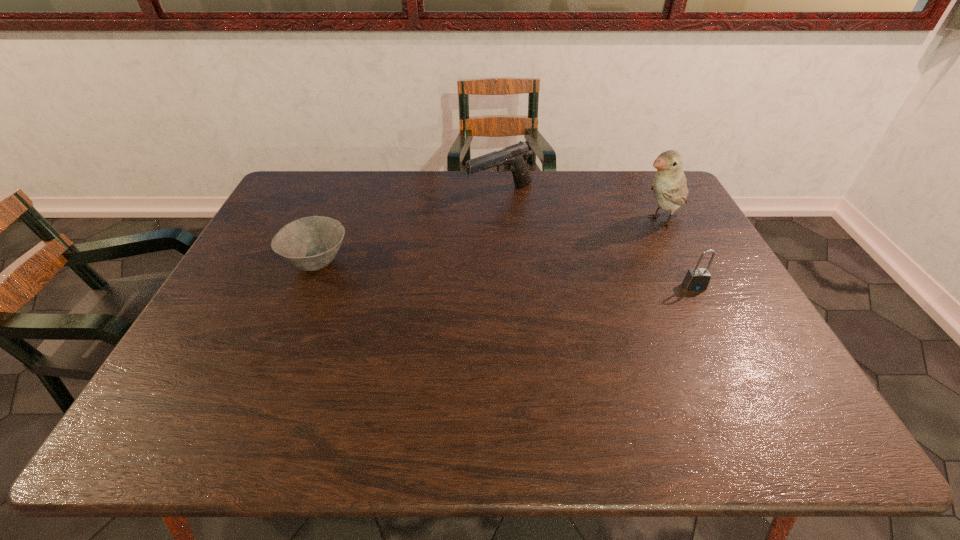
You are a GUI agent. You are given a task and a screenshot of the screen. Output one action in this format:
    pyautogui.click(x=<x>, y=<y>)
    Task: Click on the free point located at the face of the tallest object
    
    Given the screenshot: What is the action you would take?
    pyautogui.click(x=616, y=237)

You are a GUI agent. You are given a task and a screenshot of the screen. Output one action in this format:
    pyautogui.click(x=<x>, y=<y>)
    Task: Click on the free space located at the face of the tallest object
    
    Given the screenshot: What is the action you would take?
    tap(570, 258)

Image resolution: width=960 pixels, height=540 pixels. I want to click on vacant space positioned at the muzzle of the gun, so click(x=470, y=242).

Where is `vacant area situated at the muzzle of the gun`? vacant area situated at the muzzle of the gun is located at coordinates (x=476, y=232).

Identify the location of vacant space located 0.280m at the muzzle of the gun. The width and height of the screenshot is (960, 540). (460, 261).

This screenshot has height=540, width=960. In order to click on object that is at the far edge in this screenshot , I will do `click(514, 158)`.

Find the location of `object located in the left edge section of the desktop`. object located in the left edge section of the desktop is located at coordinates (310, 243).

Where is `padlock present at the right edge`? The height and width of the screenshot is (540, 960). padlock present at the right edge is located at coordinates (697, 279).

This screenshot has width=960, height=540. I want to click on bird that is at the right edge, so click(669, 186).

This screenshot has width=960, height=540. I want to click on vacant space at the far edge of the desktop, so click(x=479, y=190).